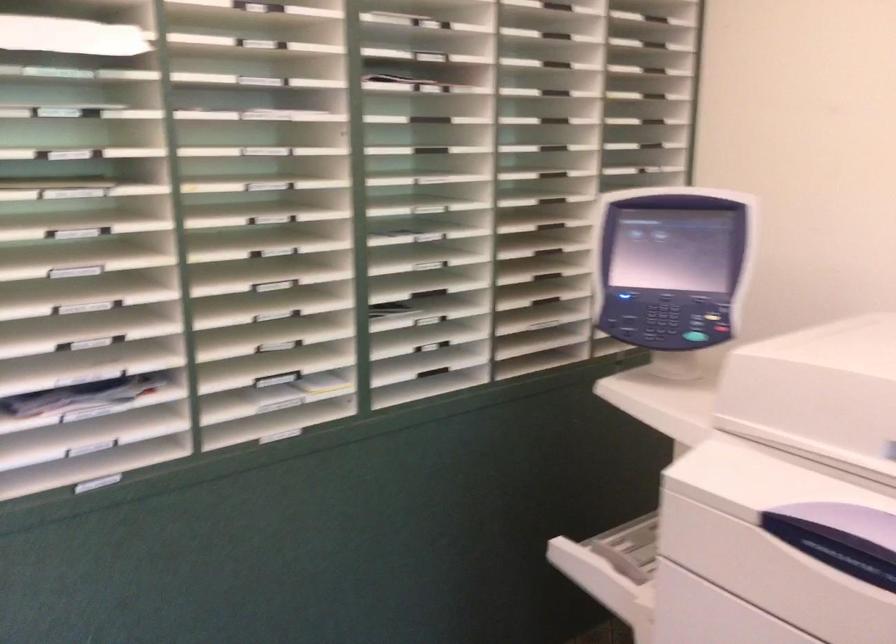
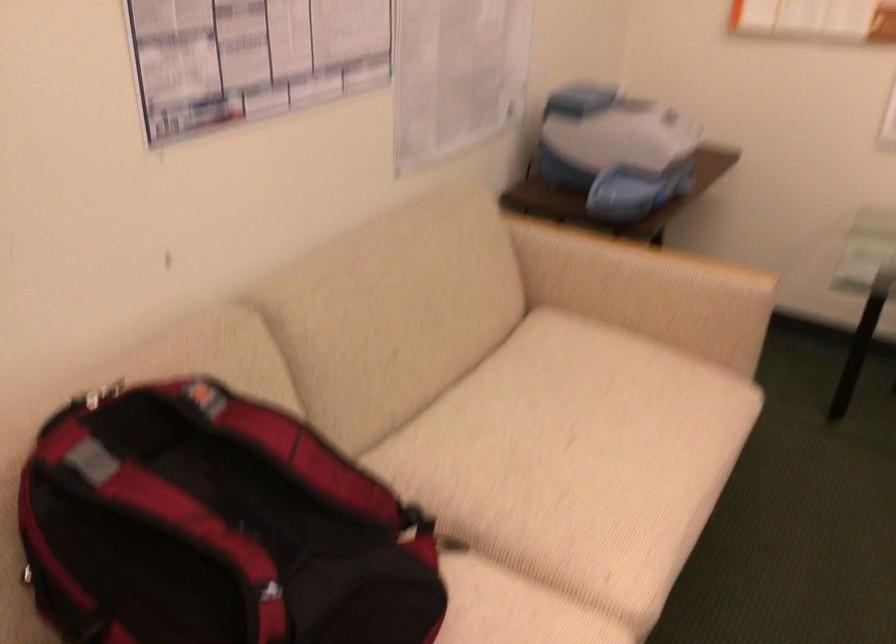
In the scene shown: In a continuous first-person perspective shot, in which direction is the camera moving?

The movement direction of the cameraman is left, forward.